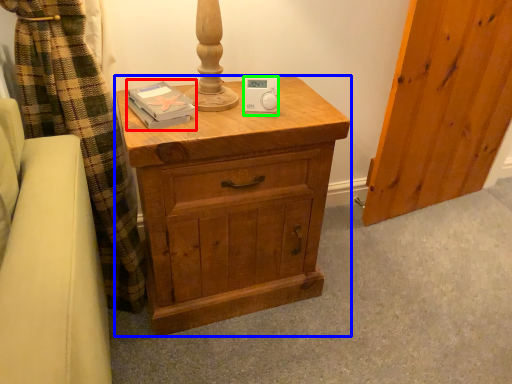
Question: Estimate the real-world distances between objects in this image. Which object is farther from book (highlighted by a red box), chest of drawers (highlighted by a blue box) or ipod (highlighted by a green box)?

Choices:
 (A) chest of drawers
 (B) ipod

Answer: (A)